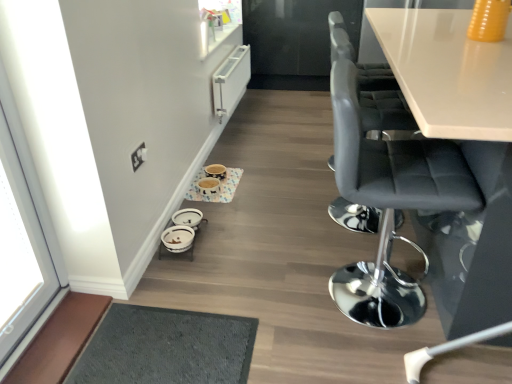
At what (x,y) coordinates should I click in order to perform the action: click on empty space that is in between gray fabric chair at right, the 2th chair viewed from the front, and white ceramic bowls at lower center, the first round table when ordered from bottom to top. Please return your answer as a coordinate pair (x, y). The height and width of the screenshot is (384, 512). Looking at the image, I should click on (267, 224).